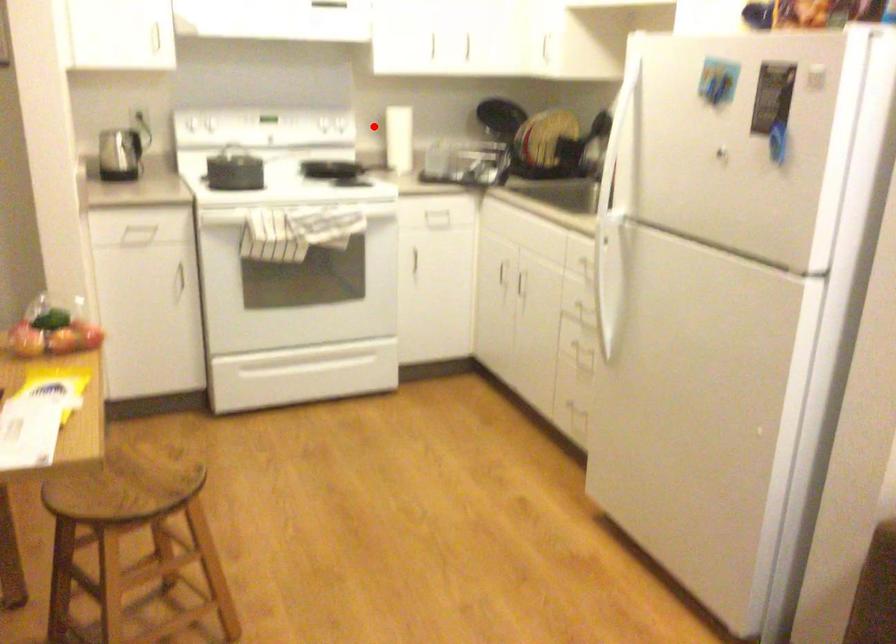
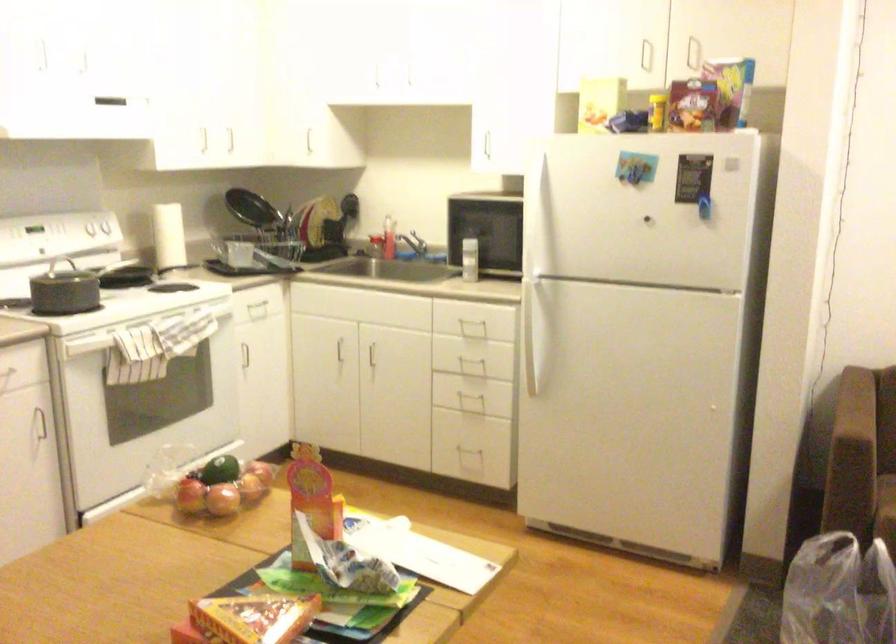
In the second image, find the point that corresponds to the highlighted location in the first image.

(168, 236)